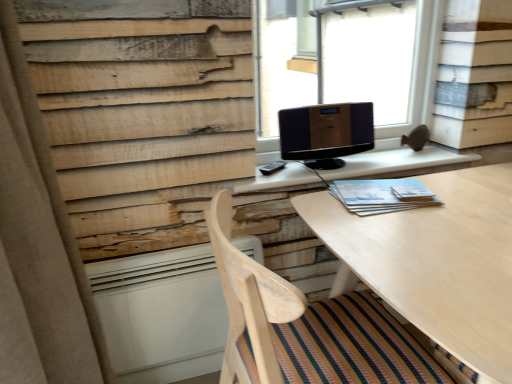
Question: Should I look upward or downward to see shiny black monitor at center?

Choices:
 (A) up
 (B) down

Answer: (A)

Question: Is shiny black monitor at center located within transparent glass speaker at upper center?

Choices:
 (A) no
 (B) yes

Answer: (A)

Question: Is transparent glass speaker at upper center positioned with its back to shiny black monitor at center?

Choices:
 (A) yes
 (B) no

Answer: (A)

Question: Can you confirm if transparent glass speaker at upper center is shorter than shiny black monitor at center?

Choices:
 (A) no
 (B) yes

Answer: (A)

Question: Considering the relative sizes of transparent glass speaker at upper center and shiny black monitor at center in the image provided, is transparent glass speaker at upper center smaller than shiny black monitor at center?

Choices:
 (A) no
 (B) yes

Answer: (A)

Question: Considering the relative positions of transparent glass speaker at upper center and shiny black monitor at center in the image provided, is transparent glass speaker at upper center to the right of shiny black monitor at center from the viewer's perspective?

Choices:
 (A) no
 (B) yes

Answer: (B)

Question: Is transparent glass speaker at upper center not inside shiny black monitor at center?

Choices:
 (A) yes
 (B) no

Answer: (A)

Question: Is light blue paper at right shorter than beige fabric curtain at left?

Choices:
 (A) yes
 (B) no

Answer: (A)

Question: Does light blue paper at right have a smaller size compared to beige fabric curtain at left?

Choices:
 (A) no
 (B) yes

Answer: (B)

Question: Is light blue paper at right to the right of beige fabric curtain at left from the viewer's perspective?

Choices:
 (A) no
 (B) yes

Answer: (B)

Question: From the image's perspective, would you say light blue paper at right is shown under beige fabric curtain at left?

Choices:
 (A) no
 (B) yes

Answer: (A)

Question: Would you say light blue paper at right is outside beige fabric curtain at left?

Choices:
 (A) no
 (B) yes

Answer: (B)

Question: From a real-world perspective, is light blue paper at right over beige fabric curtain at left?

Choices:
 (A) yes
 (B) no

Answer: (A)

Question: Is beige fabric curtain at left positioned with its back to wooden chair at lower center?

Choices:
 (A) yes
 (B) no

Answer: (A)